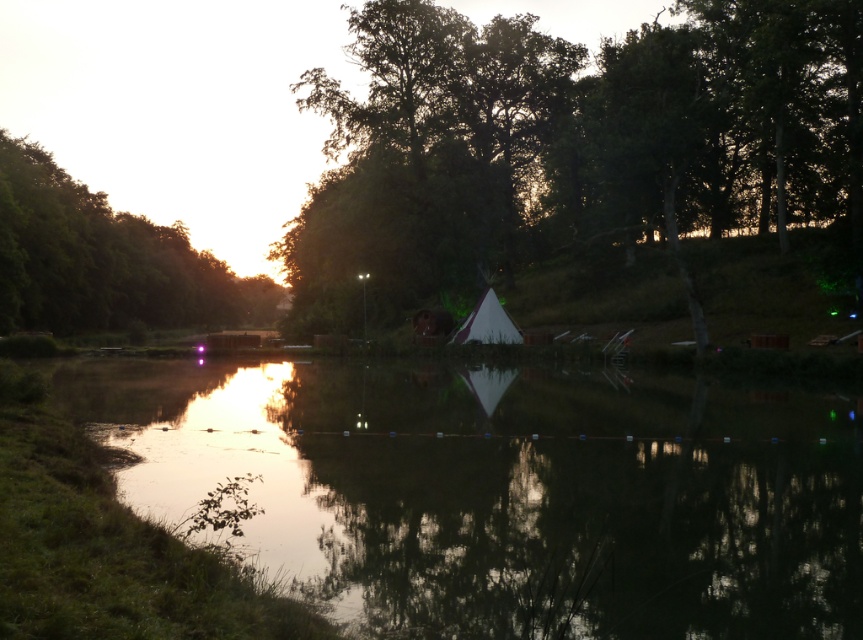
You are standing at the lakeside and want to take a photo of both the reflective glass water at center and the green leafy tree at center. Which object will appear larger in your camera viewfinder?

The reflective glass water at center will appear larger in the camera viewfinder because it is closer to the viewer than the green leafy tree at center.

You are planning to set up a picnic blanket between the green leafy tree at center and the green leafy tree at upper left. Which tree should you place the blanket closer to if you want it to be under the taller tree?

The green leafy tree at center is taller than the green leafy tree at upper left, so you should place the picnic blanket closer to the green leafy tree at center to be under the taller tree.